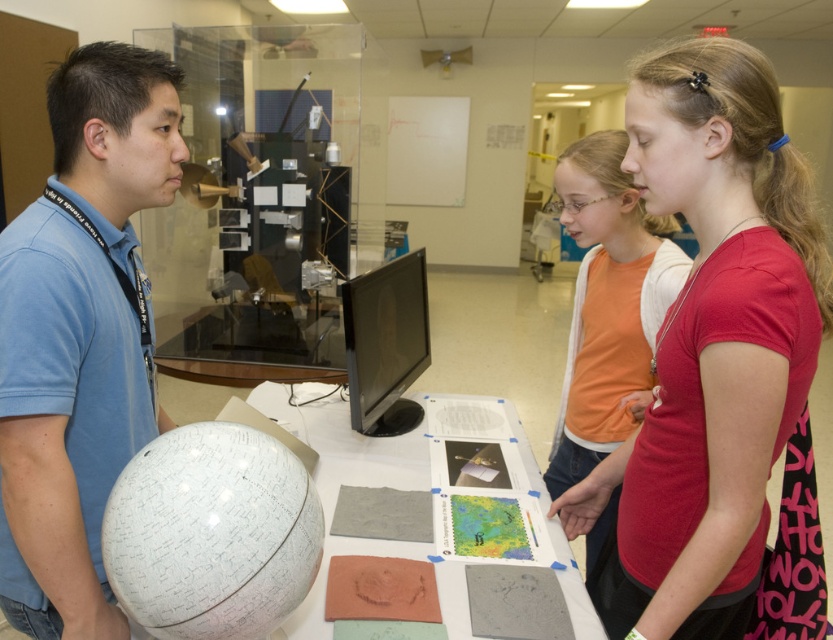
You are a visitor at the science fair and see the white matte globe at left and the matte red shirt at center. Which object is positioned more to the left?

The white matte globe at left is positioned more to the left than the matte red shirt at center.

You are a visitor at the science fair and see two people wearing the matte red shirt at center and the matte orange shirt at center. Which shirt is positioned more to the left?

The matte red shirt at center is positioned more to the left than the matte orange shirt at center.